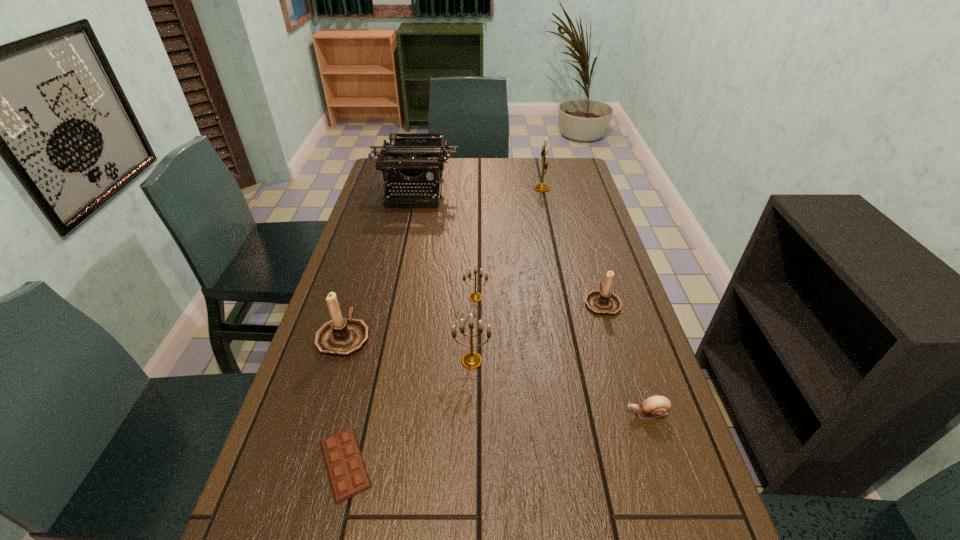
This screenshot has height=540, width=960. What are the coordinates of `the seventh farthest object` in the screenshot? It's located at (656, 406).

The image size is (960, 540). I want to click on the nearest object, so click(347, 472).

I want to click on the shortest object, so click(x=347, y=472).

Where is `free spot located on the left of the biggest gold candelabrum`? The height and width of the screenshot is (540, 960). free spot located on the left of the biggest gold candelabrum is located at coordinates click(452, 188).

Image resolution: width=960 pixels, height=540 pixels. I want to click on vacant space located on the keyboard of the typewriter, so click(402, 251).

This screenshot has height=540, width=960. I want to click on free region located 0.110m on the back of the nearest gold candelabrum, so click(x=472, y=320).

The height and width of the screenshot is (540, 960). Find the location of `blank space located 0.170m on the front of the bigger brown candle holder`. blank space located 0.170m on the front of the bigger brown candle holder is located at coordinates (318, 419).

Locate an element on the screen. The image size is (960, 540). free space located 0.370m on the back of the smaller brown candle holder is located at coordinates (577, 219).

This screenshot has width=960, height=540. What are the coordinates of `vacant space located on the right of the second farthest gold candelabrum` in the screenshot? It's located at (568, 297).

Locate an element on the screen. Image resolution: width=960 pixels, height=540 pixels. vacant space located 0.130m on the front-facing side of the second nearest object is located at coordinates (566, 414).